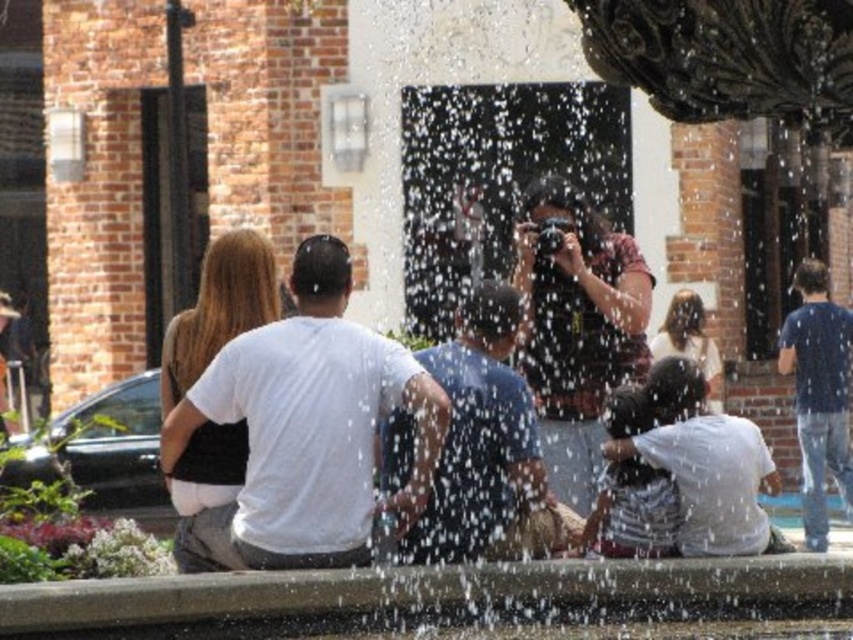
Question: Does white matte t-shirt at center have a smaller size compared to matte black camera at center?

Choices:
 (A) yes
 (B) no

Answer: (A)

Question: Estimate the real-world distances between objects in this image. Which object is closer to the matte black camera at center?

Choices:
 (A) white matte t-shirt at center
 (B) white cotton shirt at lower right

Answer: (A)

Question: Does matte black camera at center have a smaller size compared to dark blue t-shirt at right?

Choices:
 (A) no
 (B) yes

Answer: (B)

Question: Which object is positioned closest to the dark blue t-shirt at right?

Choices:
 (A) matte black camera at center
 (B) white matte t-shirt at center
 (C) white cotton shirt at lower right

Answer: (A)

Question: Can you confirm if blue cotton shirt at center is smaller than white cotton shirt at lower right?

Choices:
 (A) yes
 (B) no

Answer: (B)

Question: Which object is farther from the camera taking this photo?

Choices:
 (A) white cotton shirt at lower right
 (B) white matte t-shirt at center
 (C) blue cotton shirt at center

Answer: (A)